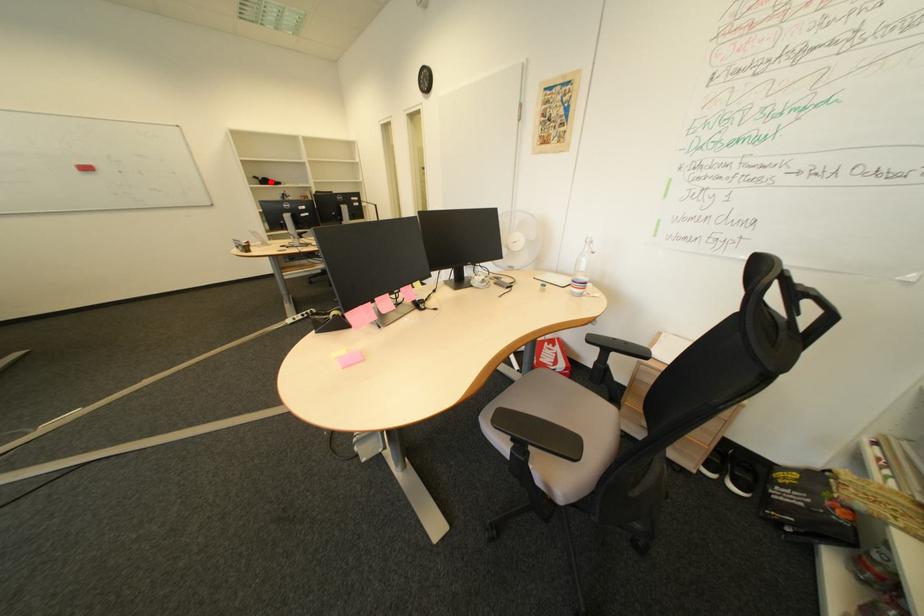
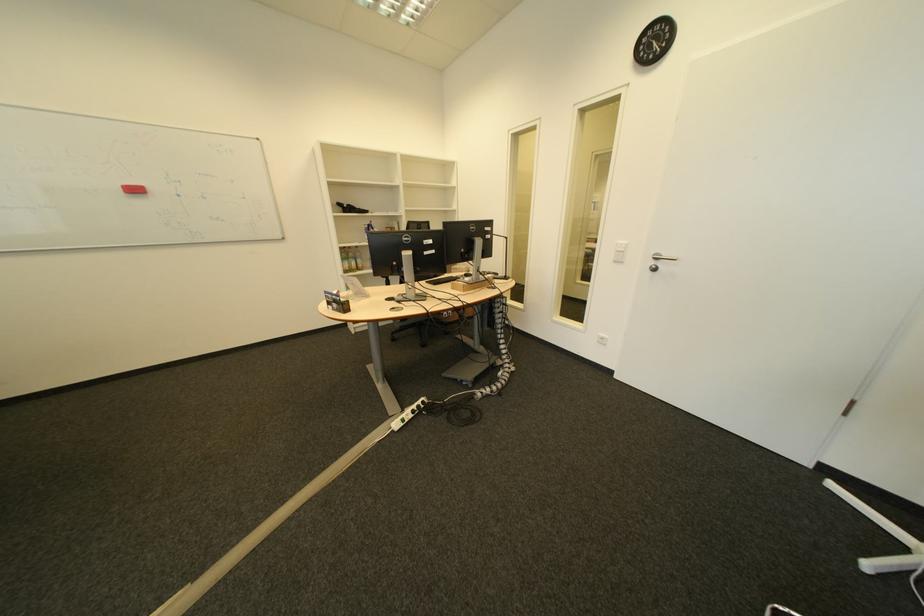
Where in the second image is the point corresponding to the highlighted location from the first image?

(354, 209)